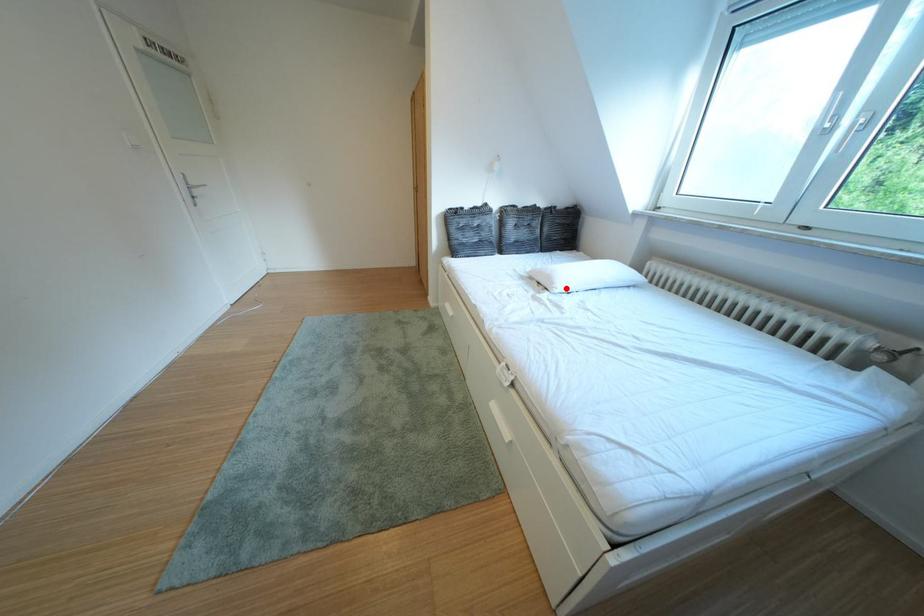
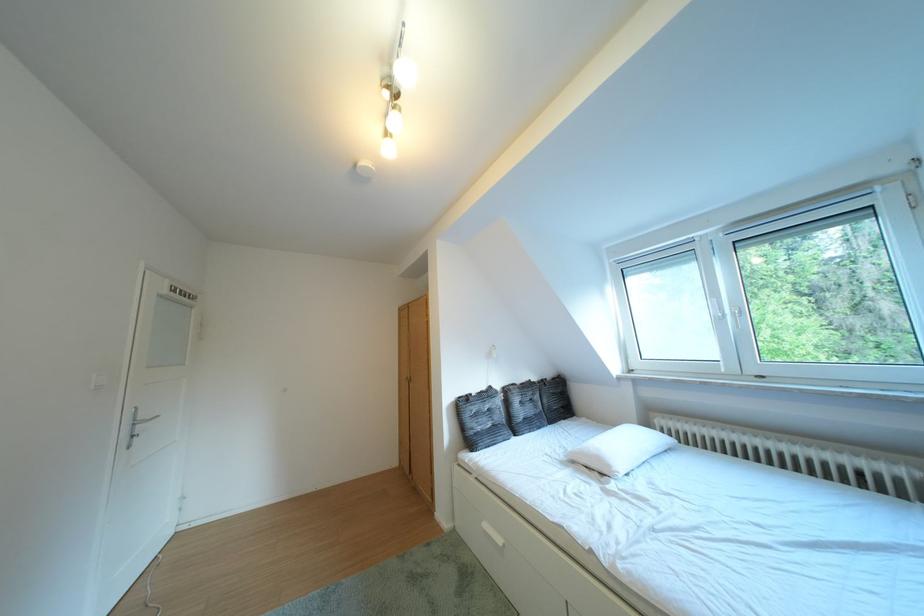
In the second image, find the point that corresponds to the highlighted location in the first image.

(623, 471)